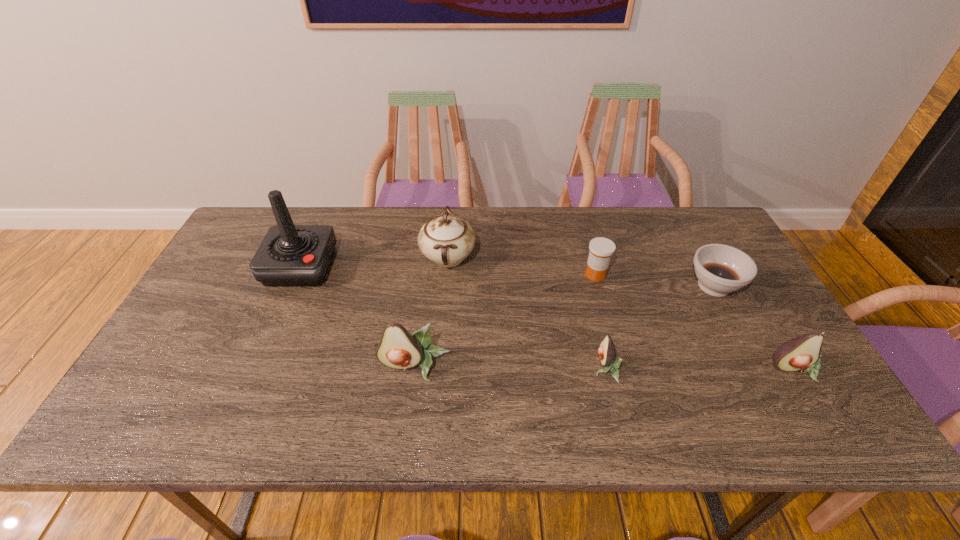
Find the location of `vacant position located on the seed side of the second avocado from right to left`. vacant position located on the seed side of the second avocado from right to left is located at coordinates (562, 368).

I want to click on vacant area situated on the right of the chinaware, so pyautogui.click(x=607, y=258).

Locate an element on the screen. free point located 0.340m on the label of the medicine is located at coordinates (626, 386).

Locate an element on the screen. The height and width of the screenshot is (540, 960). free location located on the front-facing side of the leftmost object is located at coordinates (254, 373).

Where is `free location located 0.050m on the back of the soup bowl`? The image size is (960, 540). free location located 0.050m on the back of the soup bowl is located at coordinates (698, 256).

Locate an element on the screen. chinaware that is positioned at the far edge is located at coordinates (447, 239).

This screenshot has width=960, height=540. What are the coordinates of `joystick positioned at the far edge` in the screenshot? It's located at (289, 255).

The width and height of the screenshot is (960, 540). In order to click on object located in the left edge section of the desktop in this screenshot , I will do `click(289, 255)`.

The image size is (960, 540). Identify the location of avocado situated at the right edge. (801, 353).

Where is `soup bowl that is at the right edge`? The width and height of the screenshot is (960, 540). soup bowl that is at the right edge is located at coordinates (720, 269).